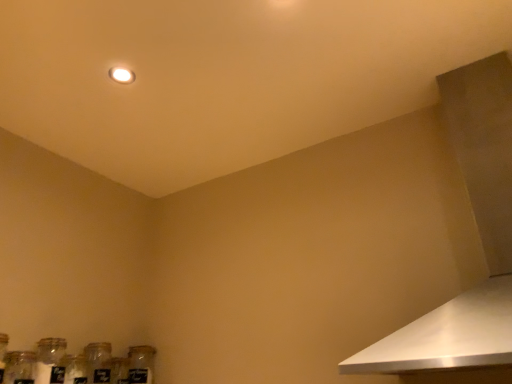
Question: Considering the relative sizes of white metallic vent at upper right and clear glass jar at lower left in the image provided, is white metallic vent at upper right shorter than clear glass jar at lower left?

Choices:
 (A) no
 (B) yes

Answer: (A)

Question: Is white metallic vent at upper right oriented towards clear glass jar at lower left?

Choices:
 (A) yes
 (B) no

Answer: (B)

Question: Does white metallic vent at upper right appear on the left side of clear glass jar at lower left?

Choices:
 (A) yes
 (B) no

Answer: (B)

Question: Does white metallic vent at upper right lie behind clear glass jar at lower left?

Choices:
 (A) no
 (B) yes

Answer: (A)

Question: Is white metallic vent at upper right next to clear glass jar at lower left and touching it?

Choices:
 (A) no
 (B) yes

Answer: (A)

Question: Do you think clear glass jar at lower left, which ranks as the 1th bottle in left-to-right order, is within white metallic vent at upper right, or outside of it?

Choices:
 (A) outside
 (B) inside

Answer: (A)

Question: Looking at their shapes, would you say clear glass jar at lower left, which ranks as the 1th bottle in left-to-right order, is wider or thinner than white metallic vent at upper right?

Choices:
 (A) wide
 (B) thin

Answer: (B)

Question: Is clear glass jar at lower left, which is the second bottle from right to left, to the left or to the right of white metallic vent at upper right in the image?

Choices:
 (A) right
 (B) left

Answer: (B)

Question: Does point click(x=41, y=372) appear closer or farther from the camera than point click(x=501, y=163)?

Choices:
 (A) closer
 (B) farther

Answer: (B)

Question: Is white metallic vent at upper right inside or outside of clear glass jar at lower left, the second bottle from the left?

Choices:
 (A) outside
 (B) inside

Answer: (A)

Question: Is white metallic vent at upper right taller or shorter than clear glass jar at lower left, the second bottle from the left?

Choices:
 (A) short
 (B) tall

Answer: (B)

Question: Considering their positions, is white metallic vent at upper right located in front of or behind clear glass jar at lower left, which is counted as the 1th bottle, starting from the right?

Choices:
 (A) front
 (B) behind

Answer: (A)

Question: Based on their positions, is white metallic vent at upper right located to the left or right of clear glass jar at lower left, the second bottle from the left?

Choices:
 (A) left
 (B) right

Answer: (B)

Question: In terms of height, does clear glass jar at lower left look taller or shorter compared to white metallic vent at upper right?

Choices:
 (A) short
 (B) tall

Answer: (A)

Question: Would you say clear glass jar at lower left is to the left or to the right of white metallic vent at upper right in the picture?

Choices:
 (A) right
 (B) left

Answer: (B)